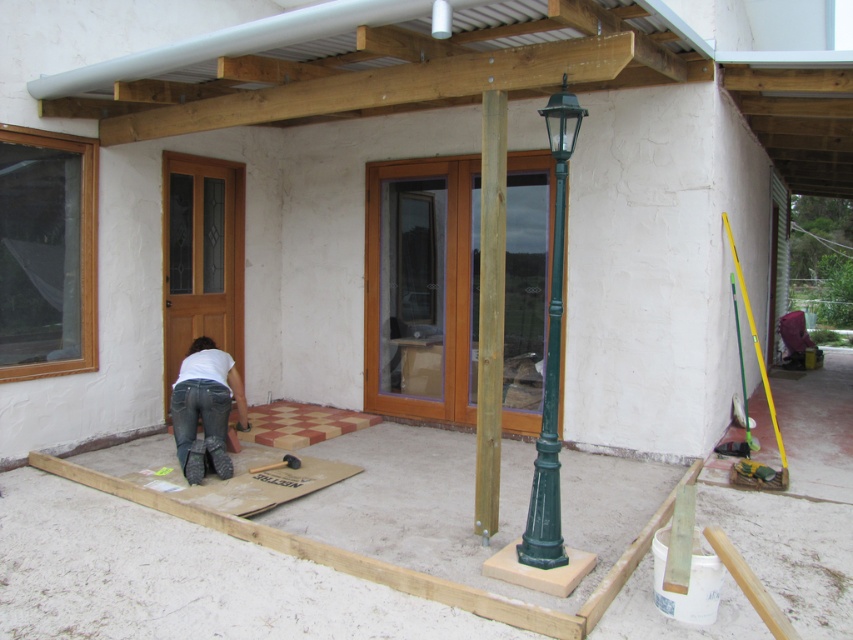
The image size is (853, 640). What are the coordinates of `green painted metal pole at center` in the screenshot? It's located at (550, 355).

Describe the element at coordinates (550, 355) in the screenshot. I see `green painted metal pole at center` at that location.

Which is behind, point (558, 92) or point (206, 451)?

The point (206, 451) is more distant.

I want to click on green painted metal pole at center, so click(550, 355).

Is point (479, 378) positioned after point (180, 460)?

No.

What do you see at coordinates (490, 310) in the screenshot? I see `brown wooden pole at center` at bounding box center [490, 310].

Is point (480, 364) positioned before point (172, 433)?

Yes, point (480, 364) is in front of point (172, 433).

The height and width of the screenshot is (640, 853). I want to click on brown wooden pole at center, so click(490, 310).

Does brown wooden pole at center have a lesser width compared to green painted metal pole at center?

Correct, brown wooden pole at center's width is less than green painted metal pole at center's.

Who is lower down, brown wooden pole at center or green painted metal pole at center?

green painted metal pole at center is lower down.

Is point (496, 348) farther from viewer compared to point (561, 260)?

No, (496, 348) is in front of (561, 260).

This screenshot has width=853, height=640. I want to click on brown wooden pole at center, so click(490, 310).